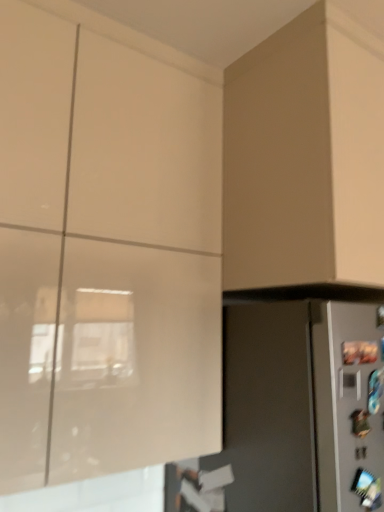
Question: From the image's perspective, would you say matte beige cabinet at upper right, acting as the 1th cabinetry starting from the right, is shown under matte white cabinet at upper left, arranged as the 1th cabinetry when viewed from the left?

Choices:
 (A) no
 (B) yes

Answer: (A)

Question: Is matte beige cabinet at upper right, arranged as the second cabinetry when viewed from the left, aimed at matte white cabinet at upper left, arranged as the 1th cabinetry when viewed from the left?

Choices:
 (A) no
 (B) yes

Answer: (A)

Question: Considering the relative positions of matte beige cabinet at upper right, arranged as the second cabinetry when viewed from the left, and matte white cabinet at upper left, which is counted as the 2th cabinetry, starting from the right, in the image provided, is matte beige cabinet at upper right, arranged as the second cabinetry when viewed from the left, to the right of matte white cabinet at upper left, which is counted as the 2th cabinetry, starting from the right, from the viewer's perspective?

Choices:
 (A) no
 (B) yes

Answer: (B)

Question: Does matte beige cabinet at upper right, arranged as the second cabinetry when viewed from the left, have a smaller size compared to matte white cabinet at upper left, which is counted as the 2th cabinetry, starting from the right?

Choices:
 (A) yes
 (B) no

Answer: (A)

Question: Considering the relative positions of matte beige cabinet at upper right, arranged as the second cabinetry when viewed from the left, and matte white cabinet at upper left, arranged as the 1th cabinetry when viewed from the left, in the image provided, is matte beige cabinet at upper right, arranged as the second cabinetry when viewed from the left, to the left of matte white cabinet at upper left, arranged as the 1th cabinetry when viewed from the left, from the viewer's perspective?

Choices:
 (A) yes
 (B) no

Answer: (B)

Question: Is matte beige cabinet at upper right, arranged as the second cabinetry when viewed from the left, positioned beyond the bounds of matte white cabinet at upper left, which is counted as the 2th cabinetry, starting from the right?

Choices:
 (A) no
 (B) yes

Answer: (B)

Question: From a real-world perspective, is matte gray refrigerator at lower right positioned over matte beige cabinet at upper right, acting as the 1th cabinetry starting from the right, based on gravity?

Choices:
 (A) yes
 (B) no

Answer: (B)

Question: Is matte beige cabinet at upper right, arranged as the second cabinetry when viewed from the left, at the back of matte gray refrigerator at lower right?

Choices:
 (A) yes
 (B) no

Answer: (B)

Question: Would you say matte gray refrigerator at lower right is a long distance from matte beige cabinet at upper right, acting as the 1th cabinetry starting from the right?

Choices:
 (A) no
 (B) yes

Answer: (A)

Question: Is matte beige cabinet at upper right, acting as the 1th cabinetry starting from the right, inside matte gray refrigerator at lower right?

Choices:
 (A) yes
 (B) no

Answer: (B)

Question: Can you confirm if matte gray refrigerator at lower right is taller than matte beige cabinet at upper right, arranged as the second cabinetry when viewed from the left?

Choices:
 (A) yes
 (B) no

Answer: (A)

Question: Is matte gray refrigerator at lower right with matte beige cabinet at upper right, arranged as the second cabinetry when viewed from the left?

Choices:
 (A) yes
 (B) no

Answer: (B)

Question: Is matte gray refrigerator at lower right positioned beyond the bounds of matte white cabinet at upper left, which is counted as the 2th cabinetry, starting from the right?

Choices:
 (A) no
 (B) yes

Answer: (B)